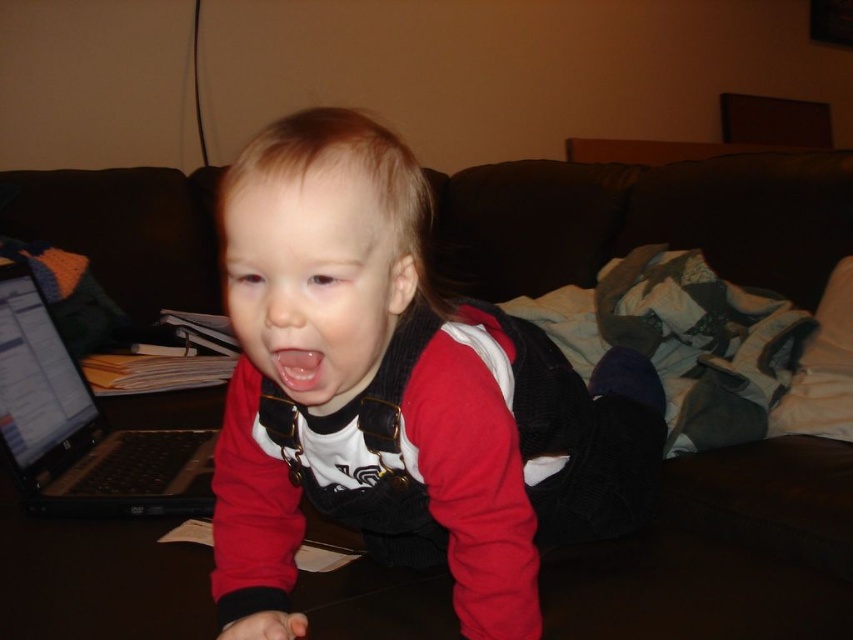
You are a photographer taking a picture of the child on the couch. The black plastic laptop at left is in the background. Where should you position yourself to ensure the laptop is not in the frame?

Since the black plastic laptop at left is located at point (82, 428), positioning yourself to the right side of the image would move the laptop out of the frame.

You are taking a photo of the child on the couch and want to ensure both the point at coordinates [587,524] and the point at coordinates [13,445] are in focus. Which point should you focus on to make sure both are sharp?

You should focus on the point closer to the camera, which is point [587,524], to ensure both points are in focus.

Please describe the exact location of the red matte vest at center in the image using coordinates. The scene is a child sitting on a couch with a laptop and scattered papers in the background.

The red matte vest at center is located at coordinates point [399,396].